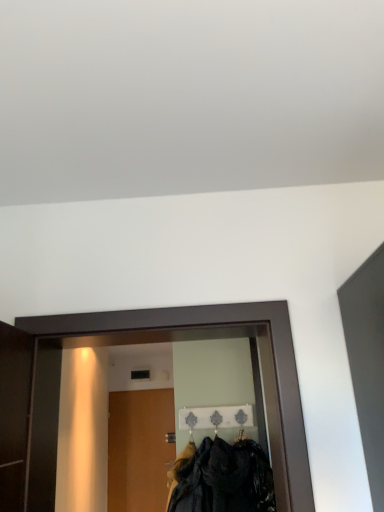
What is the approximate height of wooden door at center?

wooden door at center is 5.23 feet in height.

Measure the distance between point (164,412) and camera.

A distance of 6.74 meters exists between point (164,412) and camera.

What do you see at coordinates (139, 449) in the screenshot? I see `wooden door at center` at bounding box center [139, 449].

Where is `wooden door at center`? This screenshot has height=512, width=384. wooden door at center is located at coordinates (139, 449).

Where is `wooden door at center`? The height and width of the screenshot is (512, 384). wooden door at center is located at coordinates (139, 449).